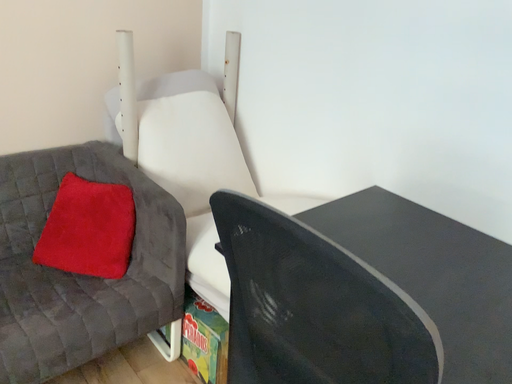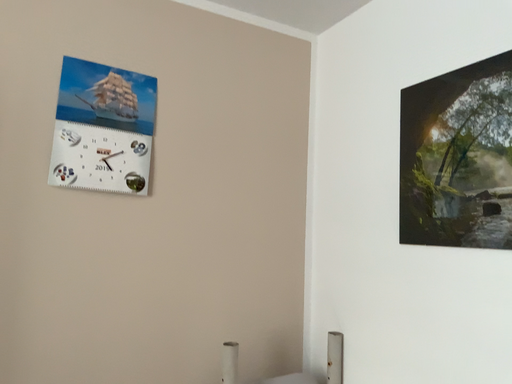
Question: Which way did the camera rotate in the video?

Choices:
 (A) rotated downward
 (B) rotated upward

Answer: (B)